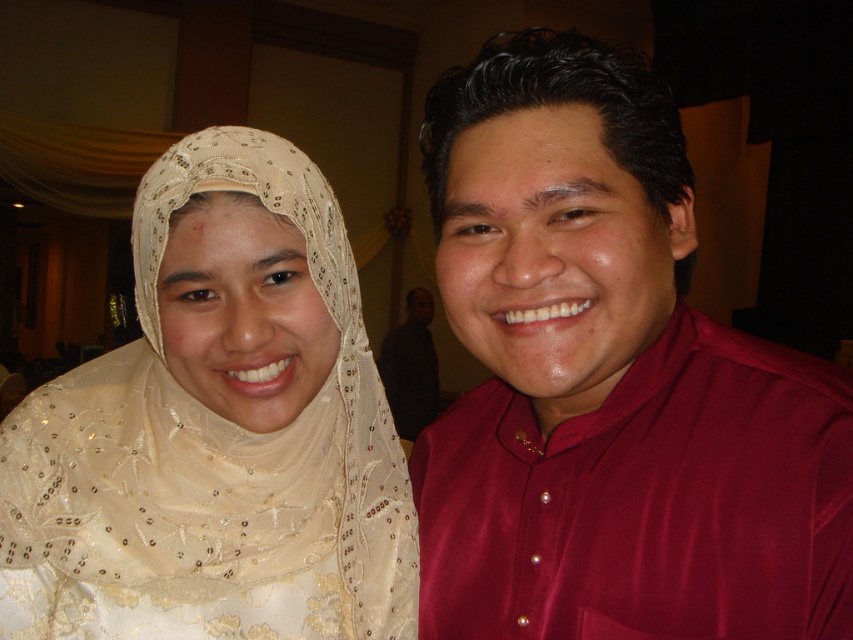
Does matte beige veil at upper left lie in front of dark brown shirt at center?

That is True.

Can you confirm if matte beige veil at upper left is thinner than dark brown shirt at center?

Incorrect, matte beige veil at upper left's width is not less than dark brown shirt at center's.

Describe the element at coordinates (216, 429) in the screenshot. The height and width of the screenshot is (640, 853). I see `matte beige veil at upper left` at that location.

At what (x,y) coordinates should I click in order to perform the action: click on matte beige veil at upper left. Please return your answer as a coordinate pair (x, y). Looking at the image, I should click on (216, 429).

Is maroon satin shirt at right thinner than dark brown shirt at center?

Correct, maroon satin shirt at right's width is less than dark brown shirt at center's.

Which is more to the left, maroon satin shirt at right or dark brown shirt at center?

dark brown shirt at center is more to the left.

Which is behind, point (434, 628) or point (416, 410)?

The point (416, 410) is more distant.

Where is `maroon satin shirt at right`? This screenshot has height=640, width=853. maroon satin shirt at right is located at coordinates (608, 381).

You are a GUI agent. You are given a task and a screenshot of the screen. Output one action in this format:
    pyautogui.click(x=<x>, y=<y>)
    Task: Click on the maroon satin shirt at right
    The height and width of the screenshot is (640, 853).
    Given the screenshot: What is the action you would take?
    pyautogui.click(x=608, y=381)

The width and height of the screenshot is (853, 640). Describe the element at coordinates (608, 381) in the screenshot. I see `maroon satin shirt at right` at that location.

You are a GUI agent. You are given a task and a screenshot of the screen. Output one action in this format:
    pyautogui.click(x=<x>, y=<y>)
    Task: Click on the maroon satin shirt at right
    The width and height of the screenshot is (853, 640).
    Given the screenshot: What is the action you would take?
    pyautogui.click(x=608, y=381)